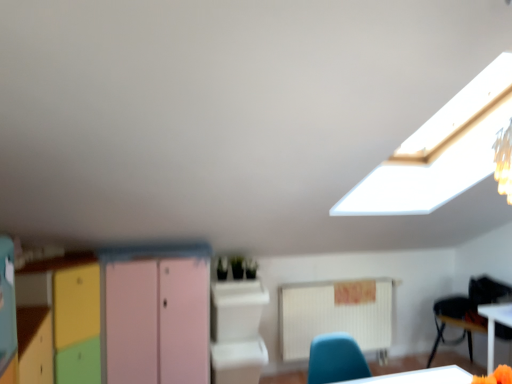
Question: Does white glossy computer desk at center have a larger size compared to white glossy table at lower right?

Choices:
 (A) yes
 (B) no

Answer: (A)

Question: Can you confirm if white glossy computer desk at center is positioned to the left of white glossy table at lower right?

Choices:
 (A) yes
 (B) no

Answer: (A)

Question: From a real-world perspective, is white glossy computer desk at center physically above white glossy table at lower right?

Choices:
 (A) yes
 (B) no

Answer: (A)

Question: From the image's perspective, does white glossy computer desk at center appear higher than white glossy table at lower right?

Choices:
 (A) no
 (B) yes

Answer: (B)

Question: From a real-world perspective, is white glossy computer desk at center positioned under white glossy table at lower right based on gravity?

Choices:
 (A) no
 (B) yes

Answer: (A)

Question: Considering the relative sizes of white glossy computer desk at center and white glossy table at lower right in the image provided, is white glossy computer desk at center smaller than white glossy table at lower right?

Choices:
 (A) yes
 (B) no

Answer: (B)

Question: Does white plastic chair at lower right have a greater height compared to pastel wood cabinet at center?

Choices:
 (A) no
 (B) yes

Answer: (A)

Question: From a real-world perspective, is white plastic chair at lower right physically above pastel wood cabinet at center?

Choices:
 (A) yes
 (B) no

Answer: (B)

Question: From the image's perspective, is white plastic chair at lower right under pastel wood cabinet at center?

Choices:
 (A) yes
 (B) no

Answer: (A)

Question: From the image's perspective, is white plastic chair at lower right over pastel wood cabinet at center?

Choices:
 (A) no
 (B) yes

Answer: (A)

Question: Considering the relative sizes of white plastic chair at lower right and pastel wood cabinet at center in the image provided, is white plastic chair at lower right bigger than pastel wood cabinet at center?

Choices:
 (A) yes
 (B) no

Answer: (B)

Question: Considering the relative positions of white plastic chair at lower right and pastel wood cabinet at center in the image provided, is white plastic chair at lower right in front of pastel wood cabinet at center?

Choices:
 (A) yes
 (B) no

Answer: (B)

Question: Considering the relative positions of white glossy table at lower right and white glossy computer desk at center in the image provided, is white glossy table at lower right to the right of white glossy computer desk at center from the viewer's perspective?

Choices:
 (A) yes
 (B) no

Answer: (A)